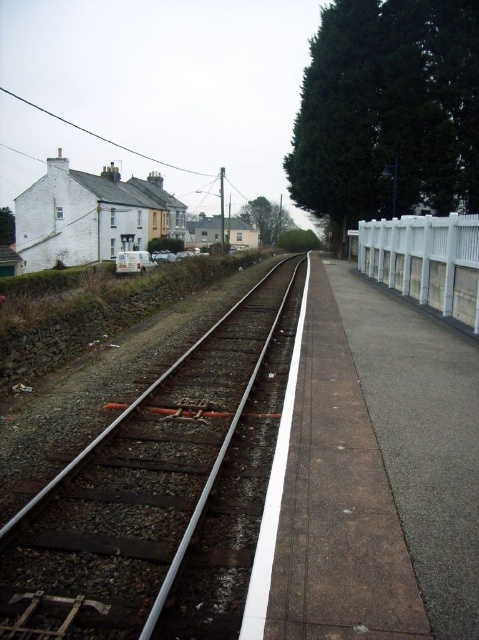
Question: Does rusty metal train track at center appear on the left side of white plastic fence at right?

Choices:
 (A) yes
 (B) no

Answer: (A)

Question: Which point is farther to the camera?

Choices:
 (A) rusty metal train track at center
 (B) white plastic fence at right

Answer: (B)

Question: Considering the relative positions of rusty metal train track at center and white plastic fence at right in the image provided, where is rusty metal train track at center located with respect to white plastic fence at right?

Choices:
 (A) left
 (B) right

Answer: (A)

Question: Which point appears closest to the camera in this image?

Choices:
 (A) (40, 561)
 (B) (428, 285)

Answer: (A)

Question: Is rusty metal train track at center closer to the viewer compared to white plastic fence at right?

Choices:
 (A) yes
 (B) no

Answer: (A)